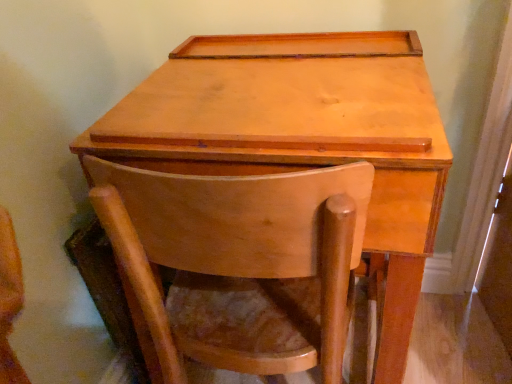
Question: Does matte wood chair at center have a greater width compared to light brown wood table at center?

Choices:
 (A) no
 (B) yes

Answer: (A)

Question: From the image's perspective, is matte wood chair at center under light brown wood table at center?

Choices:
 (A) no
 (B) yes

Answer: (B)

Question: From the image's perspective, would you say matte wood chair at center is positioned over light brown wood table at center?

Choices:
 (A) yes
 (B) no

Answer: (B)

Question: Is matte wood chair at center in front of light brown wood table at center?

Choices:
 (A) yes
 (B) no

Answer: (A)

Question: From a real-world perspective, does matte wood chair at center sit lower than light brown wood table at center?

Choices:
 (A) yes
 (B) no

Answer: (A)

Question: Is matte wood chair at center at the right side of light brown wood table at center?

Choices:
 (A) yes
 (B) no

Answer: (B)

Question: From a real-world perspective, is light brown wood table at center located higher than matte wood chair at center?

Choices:
 (A) yes
 (B) no

Answer: (A)

Question: Can you confirm if light brown wood table at center is shorter than matte wood chair at center?

Choices:
 (A) no
 (B) yes

Answer: (A)

Question: Considering the relative sizes of light brown wood table at center and matte wood chair at center in the image provided, is light brown wood table at center smaller than matte wood chair at center?

Choices:
 (A) yes
 (B) no

Answer: (B)

Question: Can you confirm if light brown wood table at center is taller than matte wood chair at center?

Choices:
 (A) yes
 (B) no

Answer: (A)

Question: From the image's perspective, is light brown wood table at center on matte wood chair at center?

Choices:
 (A) no
 (B) yes

Answer: (B)

Question: Considering the relative sizes of light brown wood table at center and matte wood chair at center in the image provided, is light brown wood table at center wider than matte wood chair at center?

Choices:
 (A) yes
 (B) no

Answer: (A)

Question: In terms of size, does matte wood chair at center appear bigger or smaller than light brown wood table at center?

Choices:
 (A) big
 (B) small

Answer: (B)